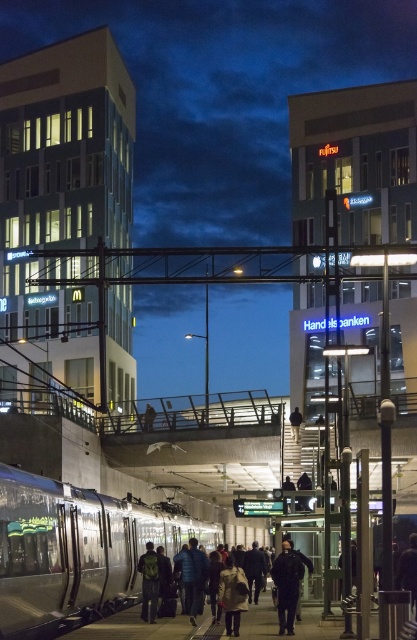
Is dark gray jacket at center thinner than dark green backpack at center?

Incorrect, dark gray jacket at center's width is not less than dark green backpack at center's.

Locate an element on the screen. dark gray jacket at center is located at coordinates (175, 627).

Is point (236, 611) behind point (156, 600)?

No, it is in front of (156, 600).

Is light beige coat at center smaller than dark green backpack at center?

Correct, light beige coat at center occupies less space than dark green backpack at center.

Identify the location of light beige coat at center. (233, 595).

Does silver metallic train at lower left have a smaller size compared to dark gray jacket at center?

No.

Which of these two, silver metallic train at lower left or dark gray jacket at center, stands shorter?

dark gray jacket at center

Does point (105, 561) lie behind point (261, 637)?

That is True.

Where is `silver metallic train at lower left`? This screenshot has height=640, width=417. silver metallic train at lower left is located at coordinates (75, 552).